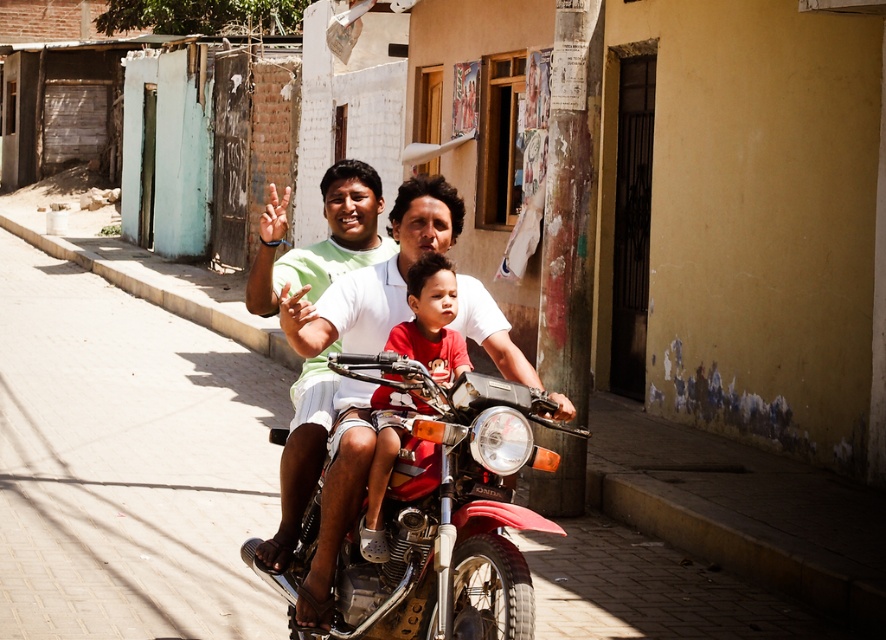
You are a photographer trying to capture the best shot of the two central shirts, the green matte shirt at center and the red cotton shirt at center. Which shirt should you focus on if you want to include both in the frame without cropping either?

You should focus on the green matte shirt at center because it is positioned to the left of the red cotton shirt at center, allowing both shirts to fit within the frame when centered.